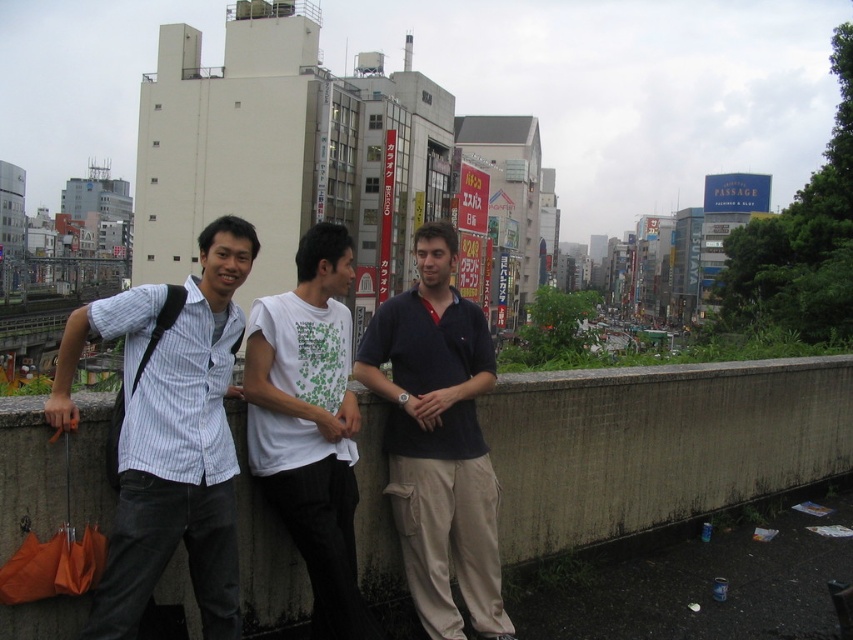
Does point (219, 275) come farther from viewer compared to point (467, 556)?

No, it is not.

The image size is (853, 640). Identify the location of striped cotton shirt at center. (170, 436).

Locate an element on the screen. striped cotton shirt at center is located at coordinates 170,436.

Which is below, concrete ledge at center or striped cotton shirt at center?

Positioned lower is concrete ledge at center.

Who is positioned more to the left, concrete ledge at center or striped cotton shirt at center?

Positioned to the left is striped cotton shirt at center.

You are a GUI agent. You are given a task and a screenshot of the screen. Output one action in this format:
    pyautogui.click(x=<x>, y=<y>)
    Task: Click on the concrete ledge at center
    
    Given the screenshot: What is the action you would take?
    pyautogui.click(x=657, y=444)

Where is `concrete ledge at center`? The width and height of the screenshot is (853, 640). concrete ledge at center is located at coordinates (657, 444).

Who is taller, concrete ledge at center or white cotton t-shirt at center?

white cotton t-shirt at center

Between concrete ledge at center and white cotton t-shirt at center, which one has less height?

concrete ledge at center is shorter.

Does point (683, 388) come in front of point (314, 406)?

No, it is behind (314, 406).

Where is `concrete ledge at center`? The height and width of the screenshot is (640, 853). concrete ledge at center is located at coordinates (657, 444).